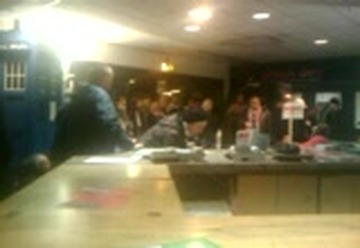
The height and width of the screenshot is (248, 360). In order to click on bright white light in this screenshot , I will do click(79, 37).